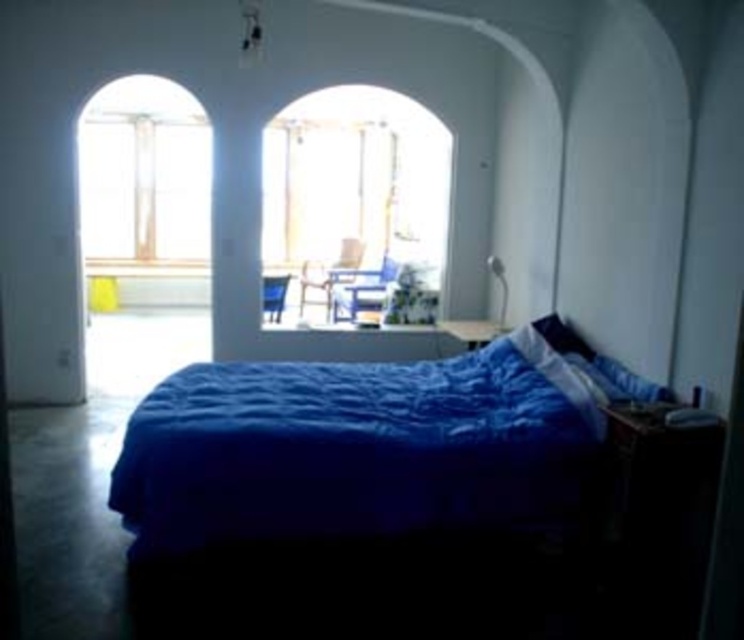
Is blue quilted bed at center bigger than clear glass window at center?

Incorrect, blue quilted bed at center is not larger than clear glass window at center.

Can you confirm if blue quilted bed at center is positioned below clear glass window at center?

Correct, blue quilted bed at center is located below clear glass window at center.

Who is more forward, (x=275, y=480) or (x=437, y=262)?

Point (x=275, y=480)

At what (x,y) coordinates should I click in order to perform the action: click on blue quilted bed at center. Please return your answer as a coordinate pair (x, y). The image size is (744, 640). Looking at the image, I should click on (365, 442).

Where is `clear glass window at center`? clear glass window at center is located at coordinates tap(356, 204).

Who is positioned more to the left, blue quilted bed at center or metallic blue chair at center?

metallic blue chair at center

Can you confirm if blue quilted bed at center is wider than metallic blue chair at center?

Yes, blue quilted bed at center is wider than metallic blue chair at center.

Which is behind, point (365, 496) or point (266, 294)?

The point (266, 294) is more distant.

What are the coordinates of `blue quilted bed at center` in the screenshot? It's located at (365, 442).